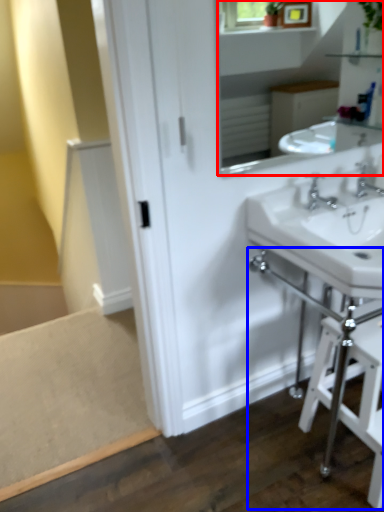
Question: Among these objects, which one is farthest to the camera, mirror (highlighted by a red box) or table (highlighted by a blue box)?

Choices:
 (A) mirror
 (B) table

Answer: (B)